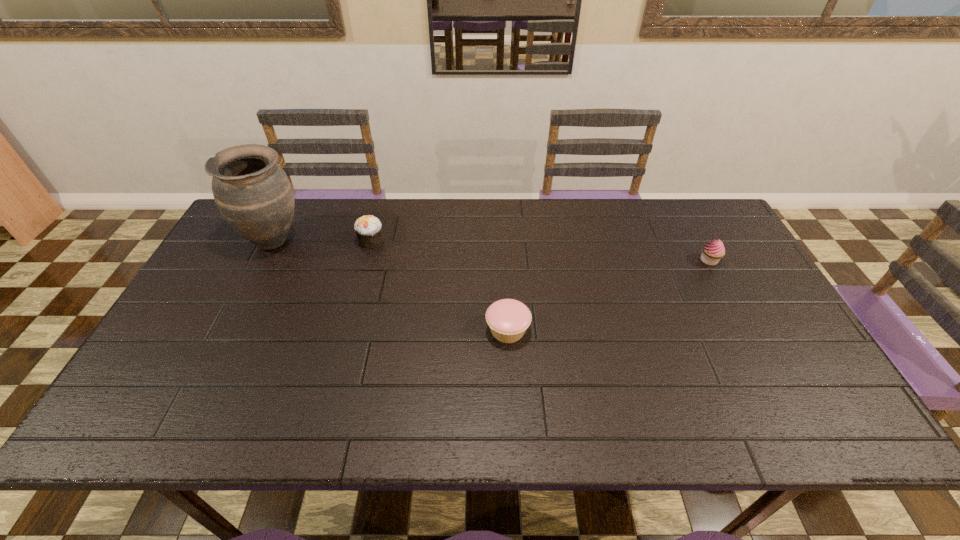
At what (x,y) coordinates should I click in order to perform the action: click on vacant space that's between the tallest object and the third object from left to right. Please return your answer as a coordinate pair (x, y). This screenshot has width=960, height=540. Looking at the image, I should click on (391, 285).

I want to click on empty location between the leftmost cupcake and the urn, so click(323, 240).

Point out which object is positioned as the third nearest to the second farthest cupcake. Please provide its 2D coordinates. Your answer should be formatted as a tuple, i.e. [(x, y)], where the tuple contains the x and y coordinates of a point satisfying the conditions above.

[(253, 193)]

Locate which object ranks third in proximity to the tallest object. Please provide its 2D coordinates. Your answer should be formatted as a tuple, i.e. [(x, y)], where the tuple contains the x and y coordinates of a point satisfying the conditions above.

[(712, 252)]

The image size is (960, 540). In order to click on cupcake identified as the second closest to the rightmost object in this screenshot , I will do `click(368, 228)`.

Identify the location of cupcake identified as the second closest to the leftmost cupcake. (712, 252).

Locate an element on the screen. The height and width of the screenshot is (540, 960). free space in the image that satisfies the following two spatial constraints: 1. on the front side of the second cupcake from right to left; 2. on the left side of the second object from left to right is located at coordinates (347, 330).

This screenshot has width=960, height=540. In order to click on vacant region that satisfies the following two spatial constraints: 1. on the front side of the rightmost object; 2. on the right side of the leftmost object in this screenshot , I will do `click(263, 260)`.

Where is `blank space that satisfies the following two spatial constraints: 1. on the front side of the second nearest cupcake; 2. on the left side of the urn`? Image resolution: width=960 pixels, height=540 pixels. blank space that satisfies the following two spatial constraints: 1. on the front side of the second nearest cupcake; 2. on the left side of the urn is located at coordinates (263, 260).